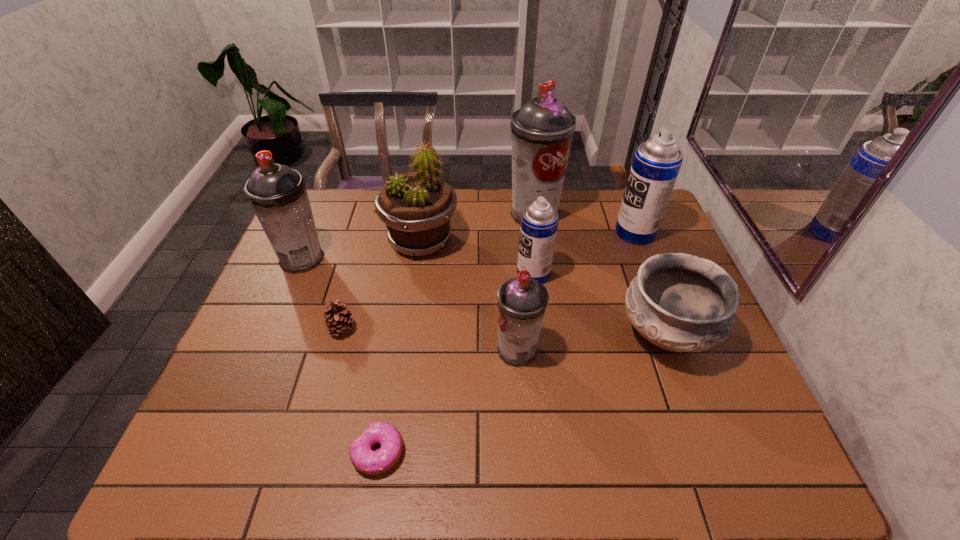
What are the coordinates of `aerosol can that stands as the fourth closest to the rightmost aerosol can` in the screenshot? It's located at (278, 195).

This screenshot has width=960, height=540. I want to click on the second closest gray aerosol can relative to the seventh tallest object, so click(542, 130).

Where is `the second closest gray aerosol can to the flowerpot`? This screenshot has width=960, height=540. the second closest gray aerosol can to the flowerpot is located at coordinates (278, 195).

Find the location of a particular element. The image size is (960, 540). free location that satisfies the following two spatial constraints: 1. on the back side of the pottery; 2. on the right side of the pink doughnut is located at coordinates (397, 334).

Find the location of a particular element. This screenshot has height=540, width=960. free space that satisfies the following two spatial constraints: 1. on the front side of the eighth tallest object; 2. on the right side of the leftmost object is located at coordinates (273, 330).